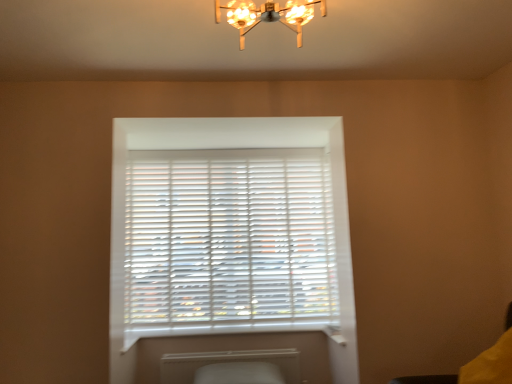
Question: Is metallic chandelier at upper center positioned far away from white matte blinds at center?

Choices:
 (A) no
 (B) yes

Answer: (B)

Question: Is metallic chandelier at upper center facing towards white matte blinds at center?

Choices:
 (A) no
 (B) yes

Answer: (A)

Question: Is metallic chandelier at upper center in front of white matte blinds at center?

Choices:
 (A) no
 (B) yes

Answer: (B)

Question: Is metallic chandelier at upper center beside white matte blinds at center?

Choices:
 (A) yes
 (B) no

Answer: (B)

Question: Does metallic chandelier at upper center have a lesser height compared to white matte blinds at center?

Choices:
 (A) no
 (B) yes

Answer: (B)

Question: Considering the relative sizes of metallic chandelier at upper center and white matte blinds at center in the image provided, is metallic chandelier at upper center wider than white matte blinds at center?

Choices:
 (A) no
 (B) yes

Answer: (B)

Question: From a real-world perspective, is white plastic window sill at lower center over white matte radiator at lower center?

Choices:
 (A) yes
 (B) no

Answer: (A)

Question: From the image's perspective, is white plastic window sill at lower center above white matte radiator at lower center?

Choices:
 (A) yes
 (B) no

Answer: (A)

Question: Can white matte radiator at lower center be found inside white plastic window sill at lower center?

Choices:
 (A) no
 (B) yes

Answer: (A)

Question: Is white plastic window sill at lower center to the left of white matte radiator at lower center from the viewer's perspective?

Choices:
 (A) no
 (B) yes

Answer: (A)

Question: Does white plastic window sill at lower center have a larger size compared to white matte radiator at lower center?

Choices:
 (A) no
 (B) yes

Answer: (A)

Question: Considering the relative sizes of white plastic window sill at lower center and white matte radiator at lower center in the image provided, is white plastic window sill at lower center smaller than white matte radiator at lower center?

Choices:
 (A) no
 (B) yes

Answer: (B)

Question: Does metallic chandelier at upper center have a greater height compared to white matte radiator at lower center?

Choices:
 (A) yes
 (B) no

Answer: (B)